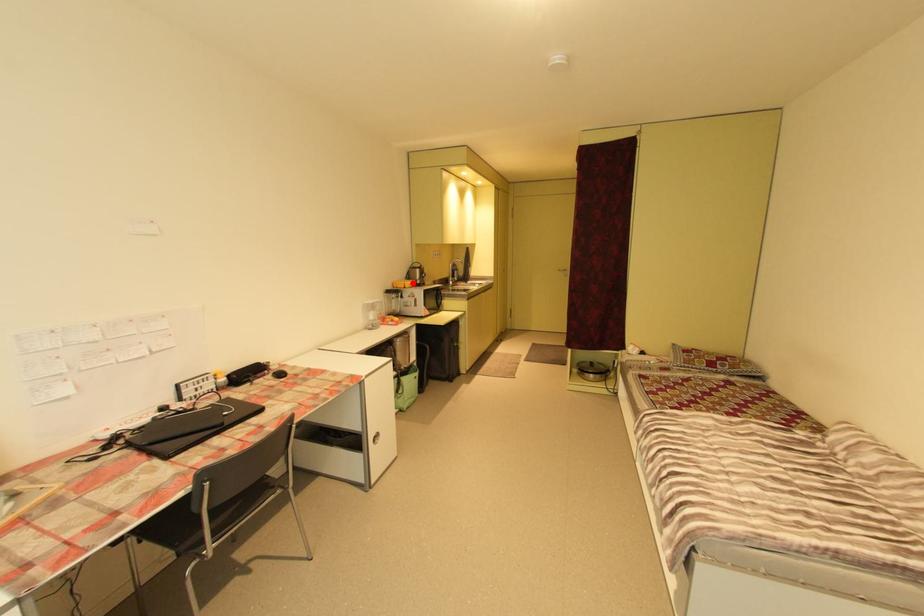
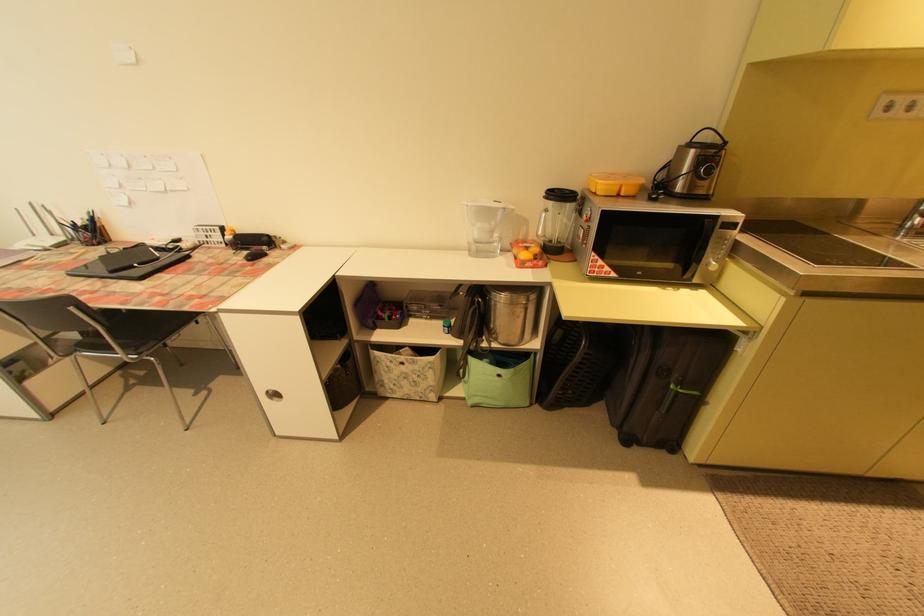
Question: I am providing you with two images of the same scene from different viewpoints. A red point is marked on the first image. At the location where the point appears in image 1, is it still visible in image 2?

Choices:
 (A) Yes
 (B) No

Answer: (A)